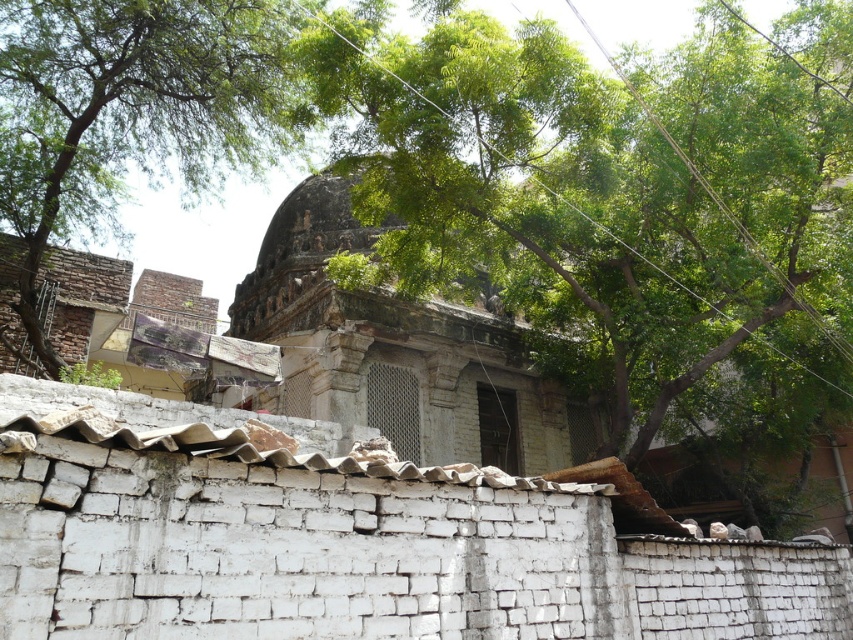
You are standing in front of the white brick wall with a corrugated metal roof. You notice two green leafy trees in the upper part of the scene. Which tree is nearer to you, the green leafy tree at upper center or the green leafy tree at upper left?

The green leafy tree at upper center is closer to the viewer than the green leafy tree at upper left.

In the scene shown: Please provide the coordinates of the green leafy tree at upper center in the image. The coordinate system has its origin at the bottom left corner of the image, with x increasing to the right and y increasing upwards. The coordinates should be given as a tuple of two decimal numbers rounded to three decimal places.

The green leafy tree at upper center is located at coordinates approximately equal to the point given in the description, so the coordinates are approximately 0.302 in the x direction and 0.686 in the y direction.